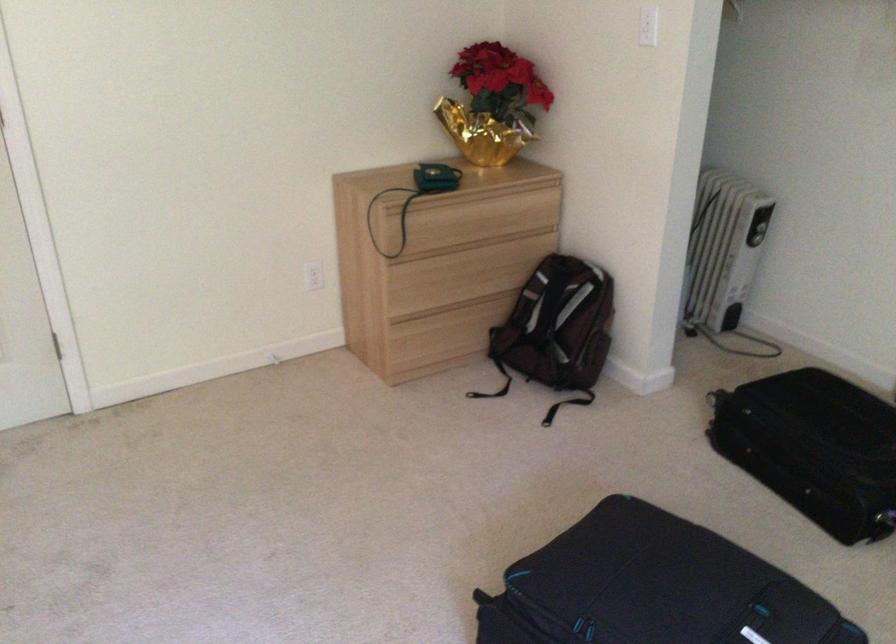
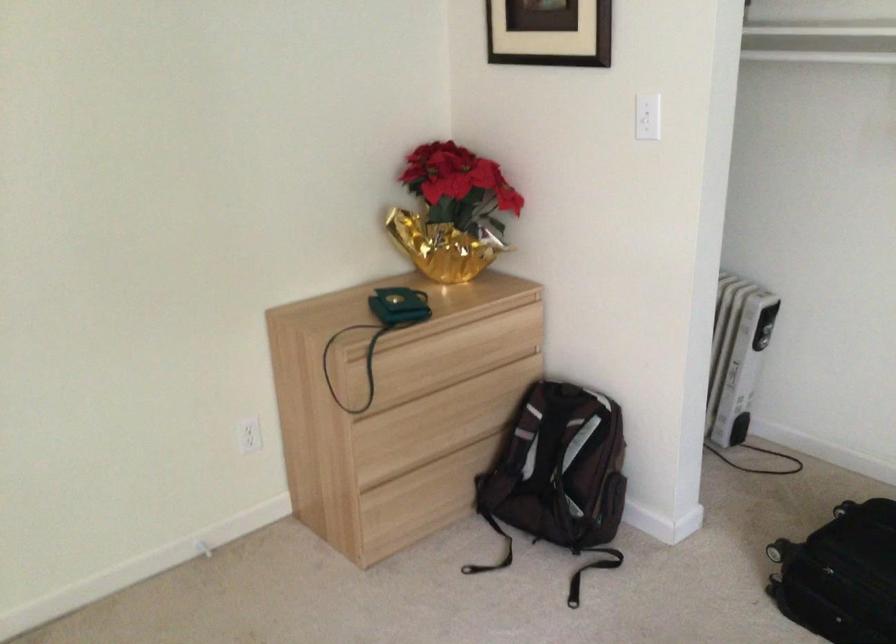
Locate, in the second image, the point that corresponds to pixel 554 322 in the first image.

(558, 468)